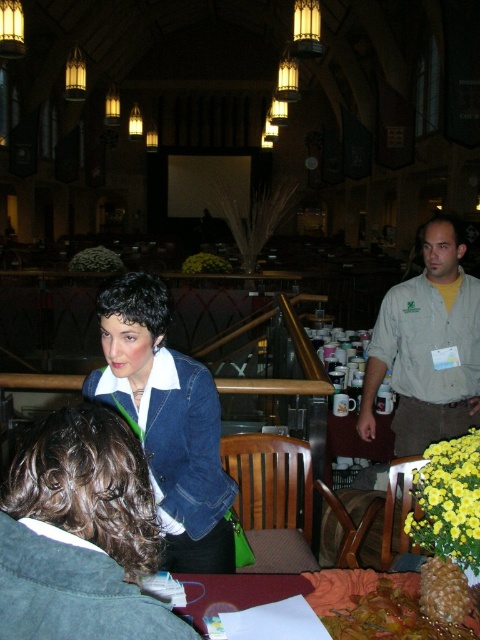
Consider the image. Between khaki shirt at right and maroon fabric table at lower center, which one is positioned higher?

khaki shirt at right is above.

Which is in front, point (371, 380) or point (192, 602)?

Point (192, 602) is in front.

Does point (451, 276) come farther from viewer compared to point (232, 579)?

That is True.

Locate an element on the screen. khaki shirt at right is located at coordinates (428, 348).

Is denim jacket at center shorter than khaki shirt at right?

Correct, denim jacket at center is not as tall as khaki shirt at right.

Is the position of denim jacket at center more distant than that of khaki shirt at right?

No.

Who is more distant from viewer, (210, 484) or (459, 360)?

The point (459, 360) is more distant.

The image size is (480, 640). Identify the location of denim jacket at center. tap(167, 422).

Between denim jacket at center and maroon fabric table at lower center, which one has more height?

Standing taller between the two is denim jacket at center.

Can you confirm if denim jacket at center is smaller than maroon fabric table at lower center?

Incorrect, denim jacket at center is not smaller in size than maroon fabric table at lower center.

Is point (143, 432) positioned after point (408, 593)?

Yes, it is behind point (408, 593).

Where is `denim jacket at center`? denim jacket at center is located at coordinates (167, 422).